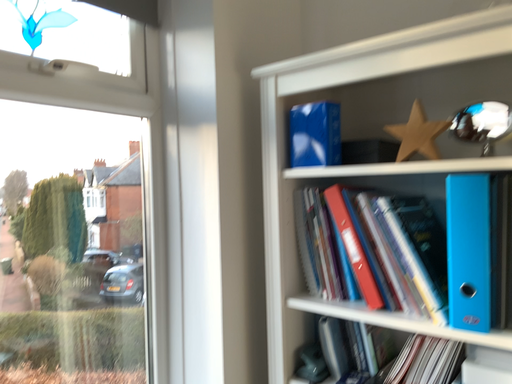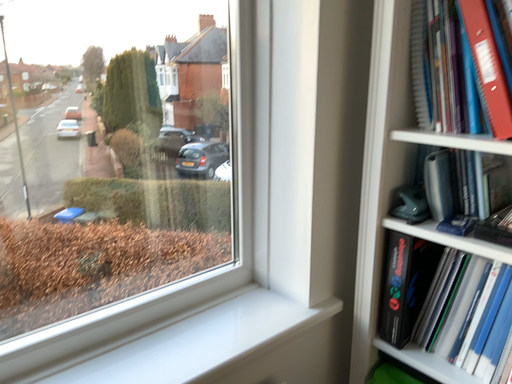
Question: How did the camera likely rotate when shooting the video?

Choices:
 (A) rotated right
 (B) rotated left

Answer: (B)